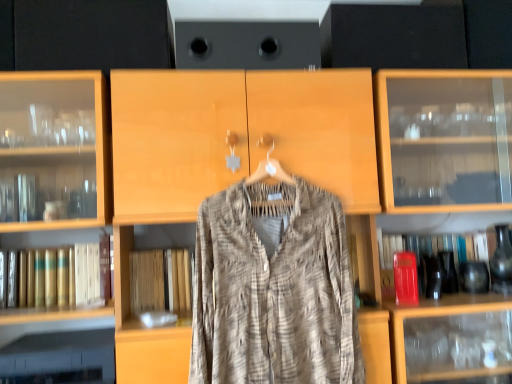
Question: Considering the relative sizes of gold leather book at left, which is counted as the first book, starting from the left, and red matte book at right, the 1th book positioned from the right, in the image provided, is gold leather book at left, which is counted as the first book, starting from the left, thinner than red matte book at right, the 1th book positioned from the right,?

Choices:
 (A) yes
 (B) no

Answer: (A)

Question: From a real-world perspective, is gold leather book at left, the second book from the right, over red matte book at right, the second book positioned from the left?

Choices:
 (A) no
 (B) yes

Answer: (B)

Question: Is gold leather book at left, which is counted as the first book, starting from the left, positioned behind red matte book at right, the 1th book positioned from the right?

Choices:
 (A) no
 (B) yes

Answer: (A)

Question: From the image's perspective, would you say gold leather book at left, which is counted as the first book, starting from the left, is shown under red matte book at right, the 1th book positioned from the right?

Choices:
 (A) no
 (B) yes

Answer: (B)

Question: Does gold leather book at left, which is counted as the first book, starting from the left, have a lesser height compared to red matte book at right, the second book positioned from the left?

Choices:
 (A) no
 (B) yes

Answer: (B)

Question: Is gold leather book at left, the second book from the right, directly adjacent to red matte book at right, the second book positioned from the left?

Choices:
 (A) yes
 (B) no

Answer: (B)

Question: Considering the relative positions of textured beige shirt at center and gold leather book at left, the second book from the right, in the image provided, is textured beige shirt at center to the left of gold leather book at left, the second book from the right, from the viewer's perspective?

Choices:
 (A) no
 (B) yes

Answer: (A)

Question: Is textured beige shirt at center shorter than gold leather book at left, which is counted as the first book, starting from the left?

Choices:
 (A) yes
 (B) no

Answer: (B)

Question: Is textured beige shirt at center facing away from gold leather book at left, the second book from the right?

Choices:
 (A) no
 (B) yes

Answer: (A)

Question: Does textured beige shirt at center turn towards gold leather book at left, the second book from the right?

Choices:
 (A) yes
 (B) no

Answer: (B)

Question: Is textured beige shirt at center outside gold leather book at left, the second book from the right?

Choices:
 (A) yes
 (B) no

Answer: (A)

Question: From the image's perspective, is textured beige shirt at center on gold leather book at left, the second book from the right?

Choices:
 (A) yes
 (B) no

Answer: (A)

Question: Is gold leather book at left, the second book from the right, in front of textured beige shirt at center?

Choices:
 (A) no
 (B) yes

Answer: (A)